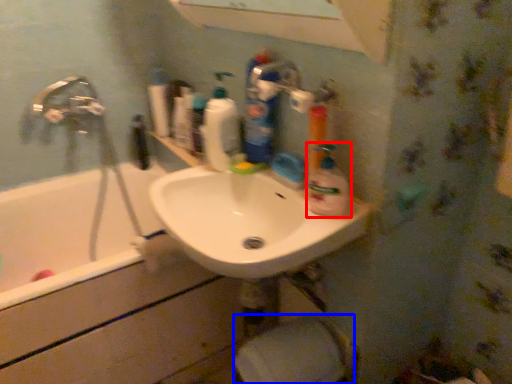
Question: Which point is further to the camera, cleaning product (highlighted by a red box) or toilet paper (highlighted by a blue box)?

Choices:
 (A) cleaning product
 (B) toilet paper

Answer: (B)